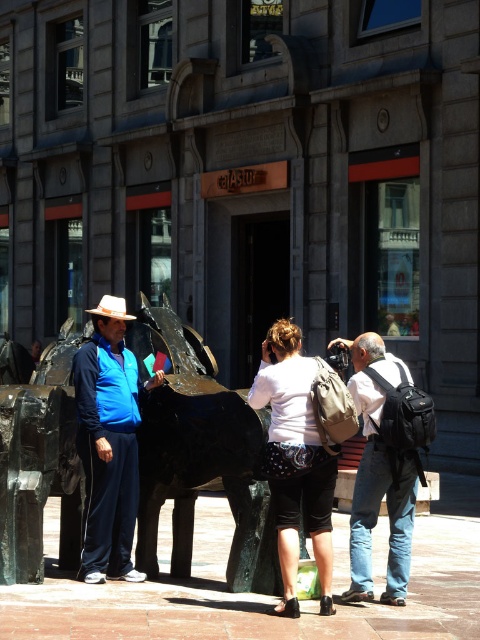
Is point (60, 435) behind point (347, 339)?

No, (60, 435) is closer to viewer.

Looking at this image, who is shorter, green polished stone sculpture at center or matte black backpack at center?

With less height is matte black backpack at center.

Image resolution: width=480 pixels, height=640 pixels. I want to click on green polished stone sculpture at center, so click(x=199, y=454).

You are a GUI agent. You are given a task and a screenshot of the screen. Output one action in this format:
    pyautogui.click(x=<x>, y=<y>)
    Task: Click on the green polished stone sculpture at center
    This screenshot has height=640, width=480.
    Given the screenshot: What is the action you would take?
    pyautogui.click(x=199, y=454)

Which of these two, blue fabric jacket at left or white matte backpack at center, stands taller?

blue fabric jacket at left is taller.

Which is more to the right, blue fabric jacket at left or white matte backpack at center?

From the viewer's perspective, white matte backpack at center appears more on the right side.

Between point (95, 397) and point (285, 582), which one is positioned in front?

Point (285, 582) is in front.

You are a GUI agent. You are given a task and a screenshot of the screen. Output one action in this format:
    pyautogui.click(x=<x>, y=<y>)
    Task: Click on the blue fabric jacket at left
    
    Given the screenshot: What is the action you would take?
    pyautogui.click(x=108, y=444)

Identify the location of blue fabric jacket at left. (108, 444).